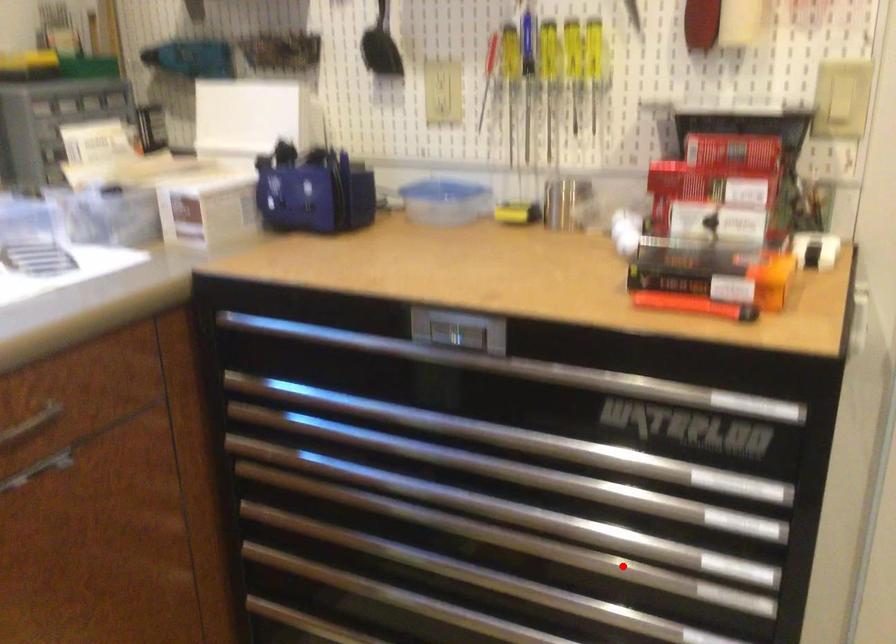
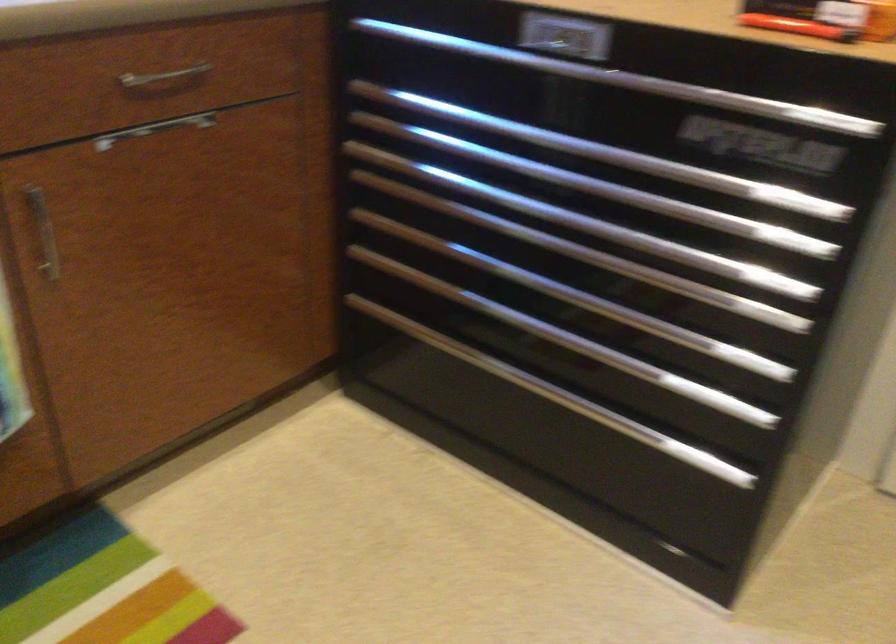
Locate, in the second image, the point that corresponds to the highlighted location in the first image.

(673, 286)